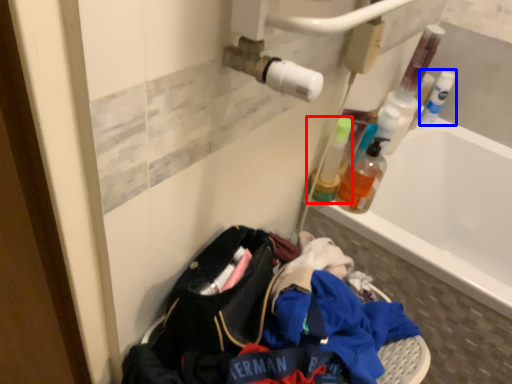
Question: Among these objects, which one is nearest to the camera, bottle (highlighted by a red box) or bottle (highlighted by a blue box)?

Choices:
 (A) bottle
 (B) bottle

Answer: (A)